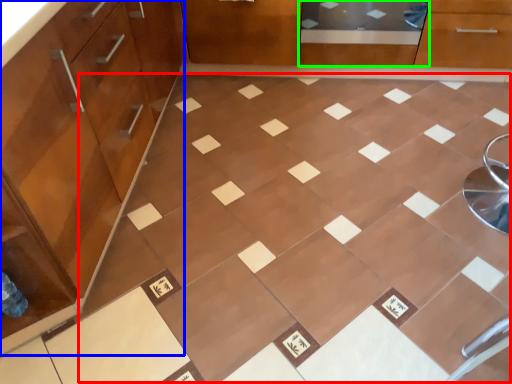
Question: Which object is the farthest from ceramic tile (highlighted by a red box)? Choose among these: cabinetry (highlighted by a blue box) or screen door (highlighted by a green box).

Choices:
 (A) cabinetry
 (B) screen door

Answer: (B)